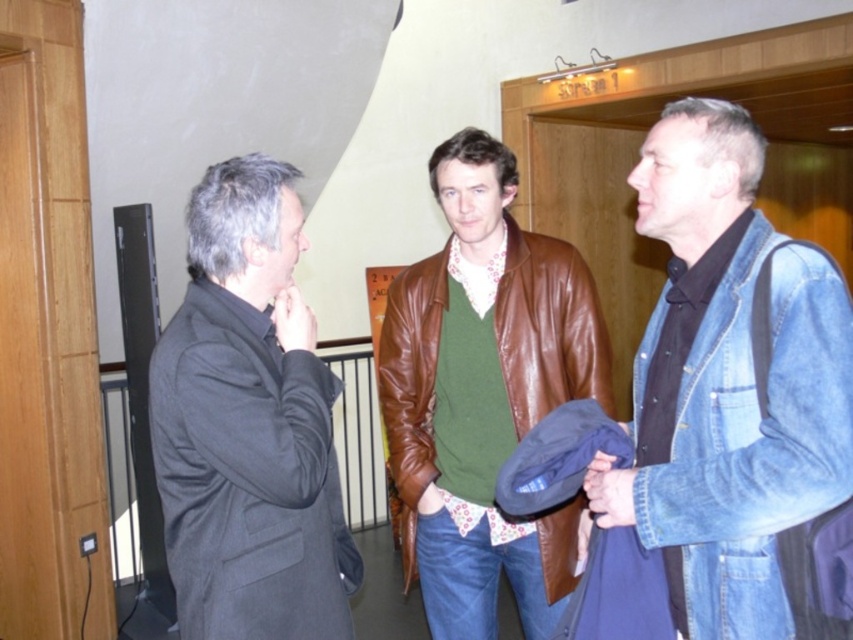
Question: Can you confirm if dark gray wool coat at left is positioned below brown leather jacket at center?

Choices:
 (A) no
 (B) yes

Answer: (A)

Question: Which is nearer to the denim jacket at right?

Choices:
 (A) brown leather jacket at center
 (B) dark gray wool coat at left

Answer: (A)

Question: Which point appears closest to the camera in this image?

Choices:
 (A) (544, 300)
 (B) (738, 632)

Answer: (B)

Question: Does denim jacket at right have a lesser width compared to dark gray wool coat at left?

Choices:
 (A) no
 (B) yes

Answer: (B)

Question: Estimate the real-world distances between objects in this image. Which object is closer to the brown leather jacket at center?

Choices:
 (A) denim jacket at right
 (B) dark gray wool coat at left

Answer: (A)

Question: Considering the relative positions of denim jacket at right and brown leather jacket at center in the image provided, where is denim jacket at right located with respect to brown leather jacket at center?

Choices:
 (A) below
 (B) above

Answer: (B)